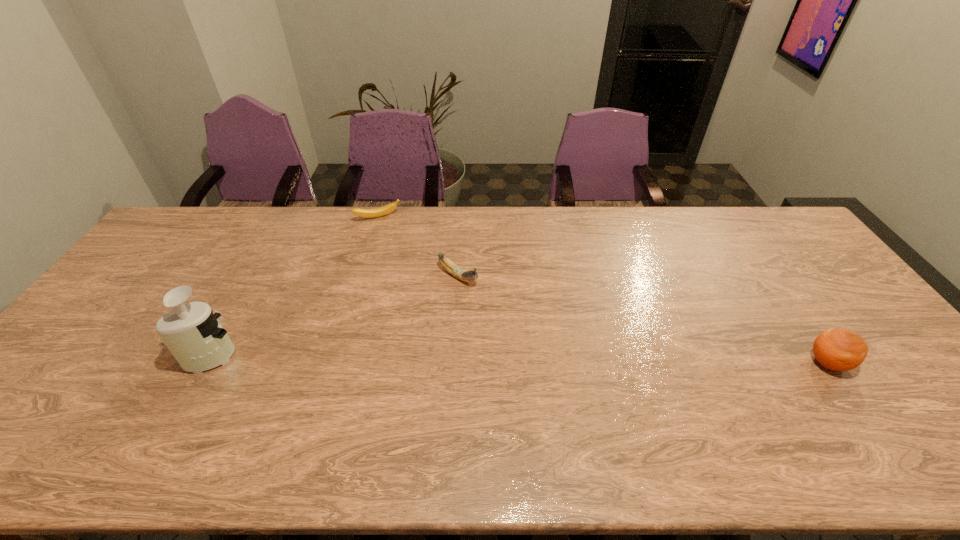
I want to click on juicer, so click(x=192, y=333).

At what (x,y) coordinates should I click in order to perform the action: click on the tallest object. Please return your answer as a coordinate pair (x, y). Looking at the image, I should click on (192, 333).

At what (x,y) coordinates should I click in order to perform the action: click on orange. Please return your answer as a coordinate pair (x, y). The image size is (960, 540). Looking at the image, I should click on (837, 349).

Locate an element on the screen. This screenshot has height=540, width=960. the rightmost object is located at coordinates (837, 349).

Identify the location of the nearer banana. (465, 275).

What are the coordinates of `the second object from right to left` in the screenshot? It's located at (465, 275).

Find the location of a particular element. the left banana is located at coordinates (377, 212).

Image resolution: width=960 pixels, height=540 pixels. I want to click on the farther banana, so click(377, 212).

Locate an element on the screen. free region located 0.180m on the right of the juicer is located at coordinates (310, 354).

This screenshot has width=960, height=540. In order to click on free spot located on the left of the third shortest object in this screenshot , I will do `click(690, 363)`.